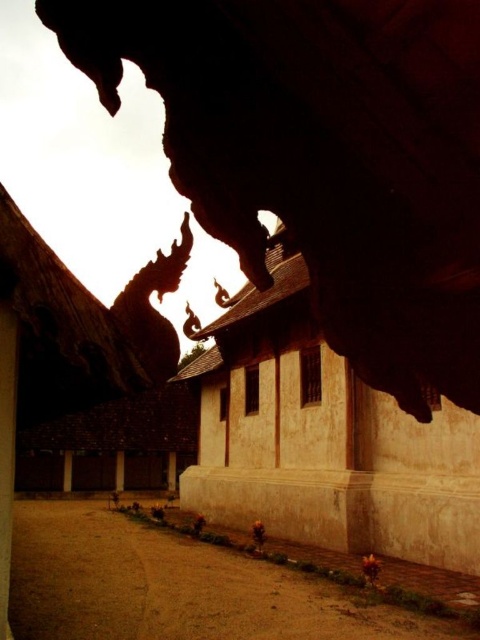
Can you confirm if beige textured wall at center is bigger than smooth stone pillar at center?

Yes.

Does point (297, 276) lie behind point (170, 470)?

That is False.

Does point (271, 484) come farther from viewer compared to point (176, 461)?

No, (271, 484) is closer to viewer.

The height and width of the screenshot is (640, 480). What are the coordinates of `beige textured wall at center` in the screenshot? It's located at pyautogui.click(x=323, y=438).

Can you confirm if beige textured wall at center is smaller than brown wood pillar at lower left?

Incorrect, beige textured wall at center is not smaller in size than brown wood pillar at lower left.

Is beige textured wall at center positioned at the back of brown wood pillar at lower left?

No, it is in front of brown wood pillar at lower left.

Where is `beige textured wall at center`? beige textured wall at center is located at coordinates (323, 438).

Is brown wood pillar at lower left closer to camera compared to smooth stone pillar at center?

Yes, it is in front of smooth stone pillar at center.

Which of these two, brown wood pillar at lower left or smooth stone pillar at center, stands shorter?

Standing shorter between the two is brown wood pillar at lower left.

Between point (72, 476) and point (167, 472), which one is positioned in front?

Point (72, 476) is more forward.

The height and width of the screenshot is (640, 480). In order to click on brown wood pillar at lower left in this screenshot , I will do pyautogui.click(x=68, y=470).